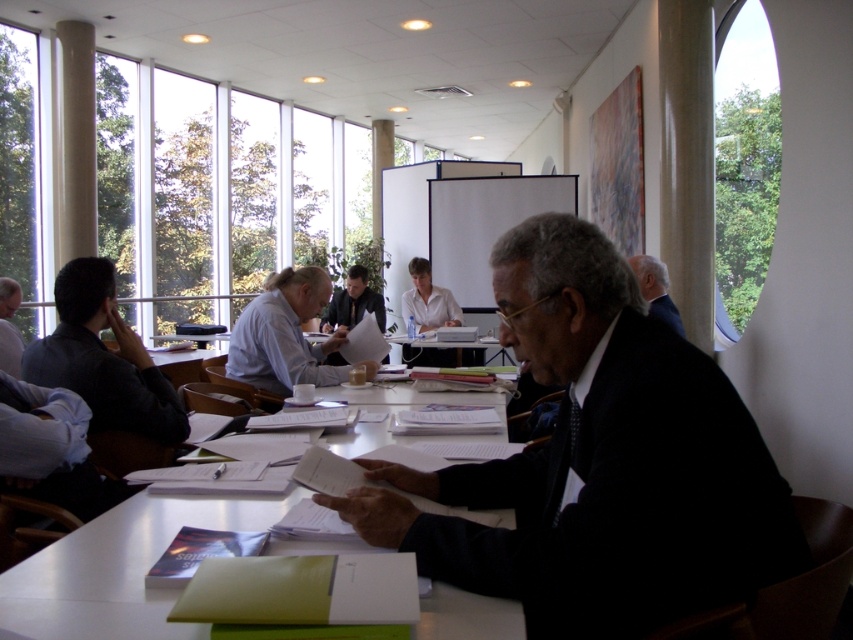
You are a photographer standing behind the group at the meeting. You need to take a photo of the dark suit at center and the dark blue shirt at center. Which one should you focus on to ensure both are in frame without moving the camera?

The dark suit at center is wider than the dark blue shirt at center, so focusing on the dark suit at center would ensure both are in frame since it occupies more space.

You are a new attendee at the meeting and need to sit between the dark suit at center and the dark blue shirt at center. Is there enough space between them to fit a standard chair that requires 2 meters of space?

The distance between the dark suit at center and the dark blue shirt at center is 4.88 meters, which is more than enough to accommodate a standard chair requiring 2 meters of space.